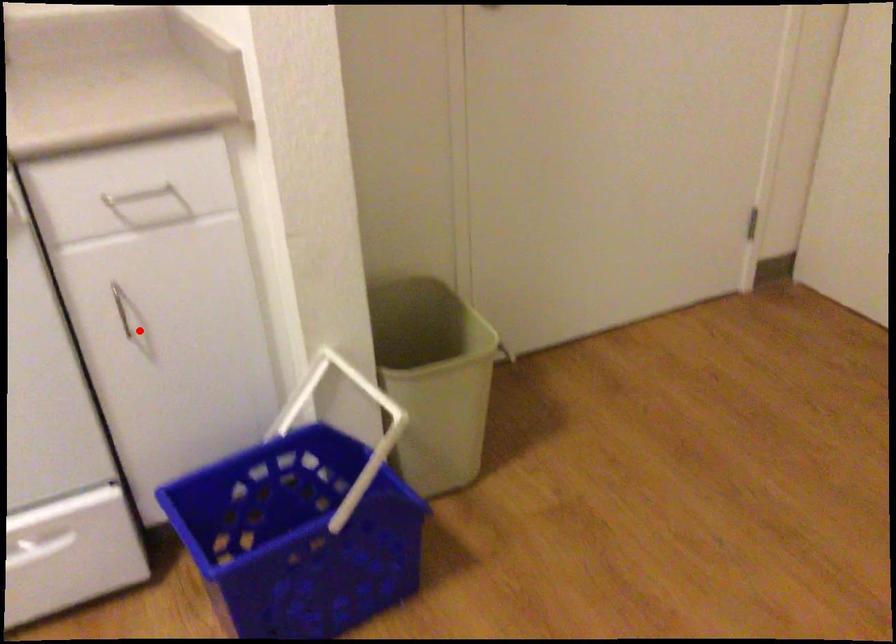
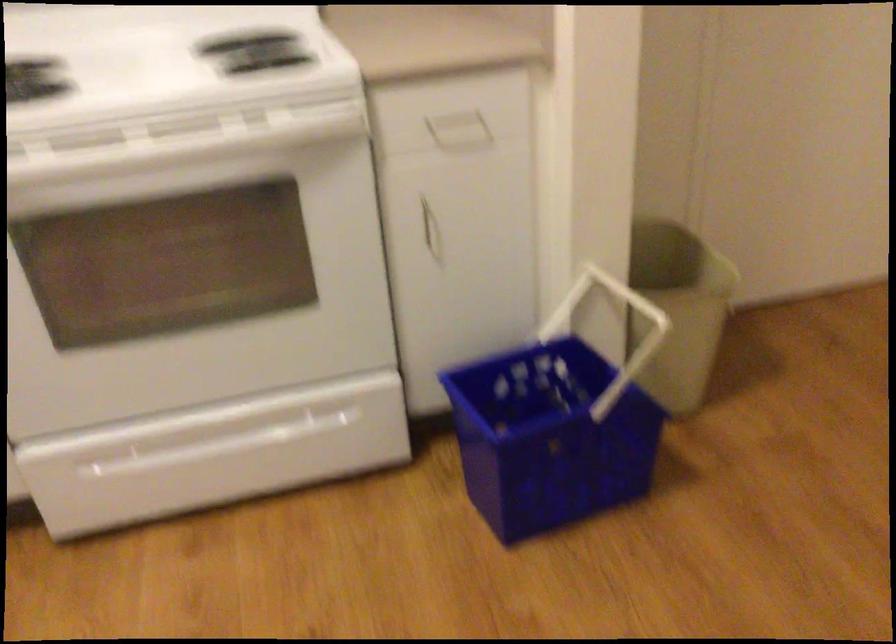
Question: I am providing you with two images of the same scene from different viewpoints. Given a red point in image1, look at the same physical point in image2. Is it:

Choices:
 (A) Closer to the viewpoint
 (B) Farther from the viewpoint

Answer: (B)